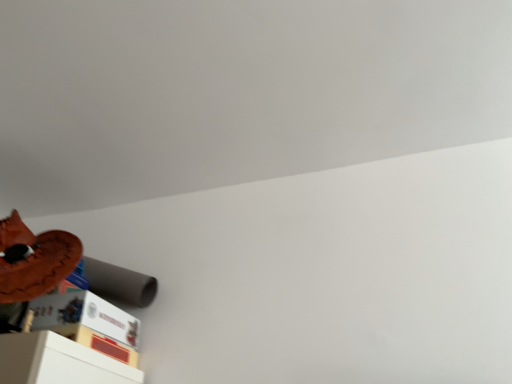
What do you see at coordinates (58, 362) in the screenshot? The width and height of the screenshot is (512, 384). I see `white glossy cabinet at lower left` at bounding box center [58, 362].

Where is `white glossy cabinet at lower left`? white glossy cabinet at lower left is located at coordinates (58, 362).

What is the approximate height of white glossy cabinet at lower left?

white glossy cabinet at lower left is 2.06 inches in height.

Find the location of a particular element. white glossy cabinet at lower left is located at coordinates (58, 362).